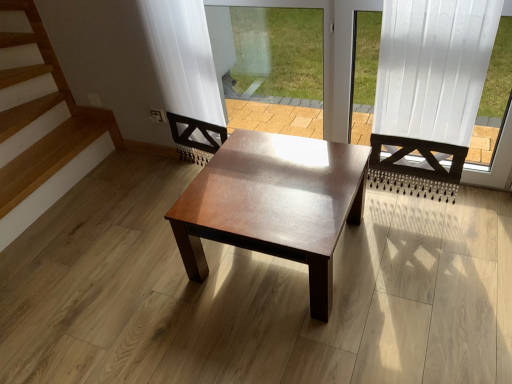
Question: Is white wood frame at upper right oriented towards transparent glass window screen at center?

Choices:
 (A) no
 (B) yes

Answer: (A)

Question: Is white wood frame at upper right at the right side of transparent glass window screen at center?

Choices:
 (A) no
 (B) yes

Answer: (B)

Question: Would you consider white wood frame at upper right to be distant from transparent glass window screen at center?

Choices:
 (A) yes
 (B) no

Answer: (B)

Question: From the image's perspective, is white wood frame at upper right on top of transparent glass window screen at center?

Choices:
 (A) no
 (B) yes

Answer: (A)

Question: Is white wood frame at upper right positioned in front of transparent glass window screen at center?

Choices:
 (A) yes
 (B) no

Answer: (A)

Question: From the image's perspective, is white wood frame at upper right under transparent glass window screen at center?

Choices:
 (A) no
 (B) yes

Answer: (B)

Question: From the image's perspective, is transparent glass window screen at center under shiny brown wood coffee table at center?

Choices:
 (A) no
 (B) yes

Answer: (A)

Question: Is transparent glass window screen at center far from shiny brown wood coffee table at center?

Choices:
 (A) yes
 (B) no

Answer: (A)

Question: Can you confirm if transparent glass window screen at center is shorter than shiny brown wood coffee table at center?

Choices:
 (A) yes
 (B) no

Answer: (B)

Question: Can you confirm if transparent glass window screen at center is taller than shiny brown wood coffee table at center?

Choices:
 (A) no
 (B) yes

Answer: (B)

Question: Considering the relative positions of transparent glass window screen at center and shiny brown wood coffee table at center in the image provided, is transparent glass window screen at center to the right of shiny brown wood coffee table at center from the viewer's perspective?

Choices:
 (A) no
 (B) yes

Answer: (A)

Question: Is transparent glass window screen at center surrounding shiny brown wood coffee table at center?

Choices:
 (A) no
 (B) yes

Answer: (A)

Question: Is white wood frame at upper right inside transparent glass window screen at center?

Choices:
 (A) yes
 (B) no

Answer: (B)